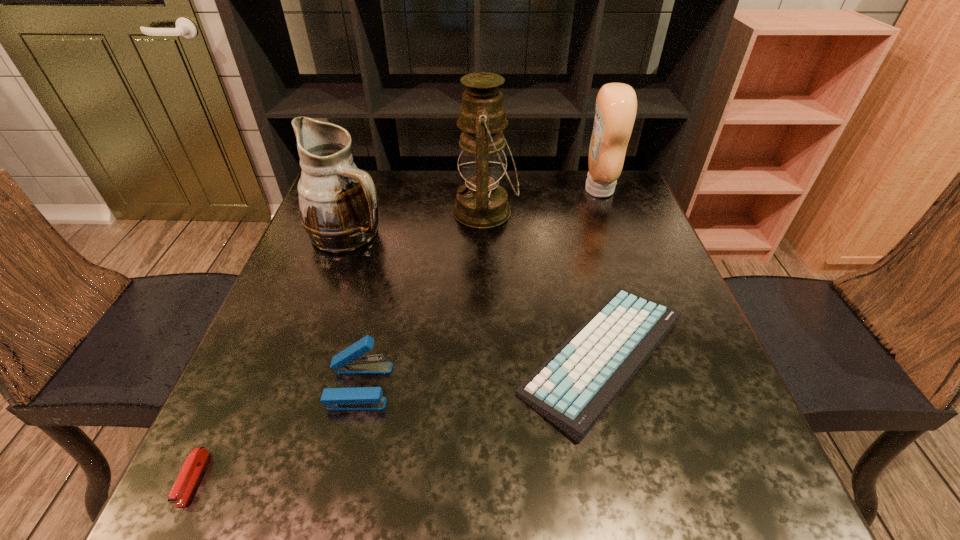
I want to click on stapler that is positioned at the left edge, so click(190, 471).

Image resolution: width=960 pixels, height=540 pixels. Find the location of `condiment positioned at the right edge`. condiment positioned at the right edge is located at coordinates (616, 104).

At what (x,y) coordinates should I click in order to perform the action: click on computer keyboard positioned at the right edge. Please return your answer as a coordinate pair (x, y). Looking at the image, I should click on (573, 388).

At what (x,y) coordinates should I click in order to perform the action: click on object that is at the far left corner. Please return your answer as a coordinate pair (x, y). This screenshot has height=540, width=960. Looking at the image, I should click on (338, 202).

The height and width of the screenshot is (540, 960). Find the location of `object situated at the near left corner`. object situated at the near left corner is located at coordinates (190, 471).

Where is `object that is at the far right corner`? The height and width of the screenshot is (540, 960). object that is at the far right corner is located at coordinates (616, 104).

What are the coordinates of `blank space at the far edge` in the screenshot? It's located at (406, 209).

In the image, there is a desktop. Where is `vacant space at the near edge`? vacant space at the near edge is located at coordinates (370, 490).

Find the location of a particular element. The height and width of the screenshot is (540, 960). free location at the left edge of the desktop is located at coordinates (324, 295).

Find the location of a particular element. This screenshot has height=540, width=960. free location at the right edge of the desktop is located at coordinates (613, 246).